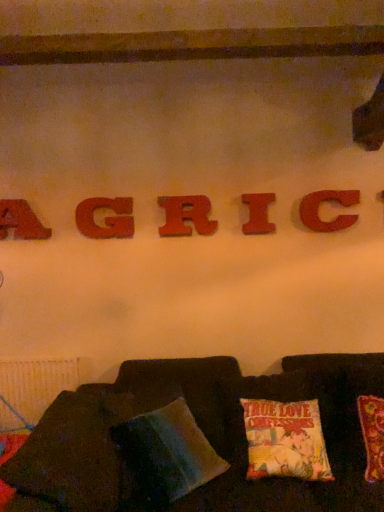
Question: Should I look upward or downward to see wooden letter c at center, which ranks as the fifth letter in left-to-right order?

Choices:
 (A) up
 (B) down

Answer: (A)

Question: Which direction should I rotate to look at matte wooden letter g at center, which is counted as the 4th letter, starting from the right?

Choices:
 (A) right
 (B) left

Answer: (B)

Question: Is matte wood letter i at center, which appears as the 2th letter when viewed from the right, turned away from velvet cushion at lower center?

Choices:
 (A) yes
 (B) no

Answer: (B)

Question: From a real-world perspective, does matte wood letter i at center, which appears as the 2th letter when viewed from the right, sit lower than velvet cushion at lower center?

Choices:
 (A) no
 (B) yes

Answer: (A)

Question: Considering the relative sizes of matte wood letter i at center, the fourth letter when ordered from left to right, and velvet cushion at lower center in the image provided, is matte wood letter i at center, the fourth letter when ordered from left to right, wider than velvet cushion at lower center?

Choices:
 (A) yes
 (B) no

Answer: (B)

Question: Is matte wood letter i at center, the fourth letter when ordered from left to right, aimed at velvet cushion at lower center?

Choices:
 (A) no
 (B) yes

Answer: (A)

Question: Is matte wood letter i at center, which appears as the 2th letter when viewed from the right, not within velvet cushion at lower center?

Choices:
 (A) yes
 (B) no

Answer: (A)

Question: From the image's perspective, does matte wood letter i at center, the fourth letter when ordered from left to right, appear higher than velvet cushion at lower center?

Choices:
 (A) yes
 (B) no

Answer: (A)

Question: Considering the relative sizes of wooden letter a at upper left, the 5th letter in the right-to-left sequence, and multicolored fabric pillow at lower center in the image provided, is wooden letter a at upper left, the 5th letter in the right-to-left sequence, smaller than multicolored fabric pillow at lower center?

Choices:
 (A) yes
 (B) no

Answer: (A)

Question: Is multicolored fabric pillow at lower center located within wooden letter a at upper left, the 5th letter in the right-to-left sequence?

Choices:
 (A) yes
 (B) no

Answer: (B)

Question: Is the depth of wooden letter a at upper left, the first letter viewed from the left, less than that of multicolored fabric pillow at lower center?

Choices:
 (A) yes
 (B) no

Answer: (B)

Question: Can you confirm if wooden letter a at upper left, the 5th letter in the right-to-left sequence, is shorter than multicolored fabric pillow at lower center?

Choices:
 (A) no
 (B) yes

Answer: (B)

Question: From the image's perspective, is wooden letter a at upper left, the first letter viewed from the left, above multicolored fabric pillow at lower center?

Choices:
 (A) yes
 (B) no

Answer: (A)

Question: From the image's perspective, is velvet cushion at lower center located beneath wooden letter r at center, the 3th letter from the left?

Choices:
 (A) no
 (B) yes

Answer: (B)